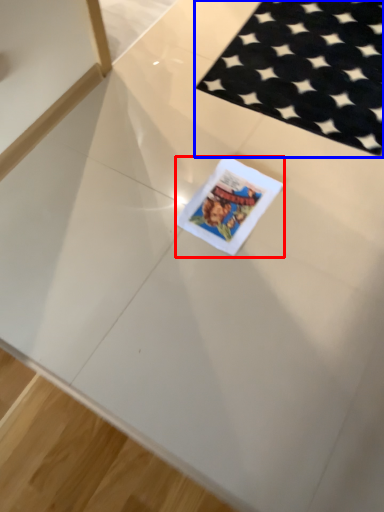
Question: Which object is further to the camera taking this photo, birthday card (highlighted by a red box) or mat (highlighted by a blue box)?

Choices:
 (A) birthday card
 (B) mat

Answer: (B)